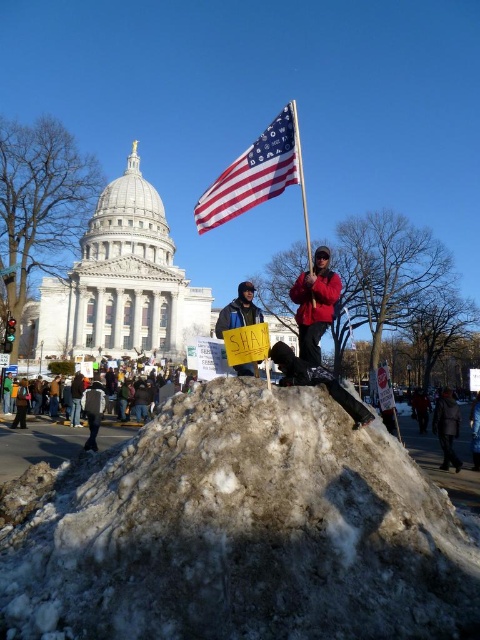
You are a photographer trying to capture the protest scene. You want to ensure the american flag at center and the red matte jacket at center are both visible in your shot. Based on their positions, which object should you focus on first to frame both effectively?

The american flag at center is located above the red matte jacket at center, so you should focus on the american flag at center first to ensure both are in frame.

You are a photographer standing at the camera position. You want to capture a closeup shot of the red matte jacket at center. Given that your camera has a minimum focusing distance of 2 meters, will you be able to take the photo without moving closer?

The distance between the red matte jacket at center and the camera is 71.96 meters, which is much greater than the camera minimum focusing distance of 2 meters. Therefore, you can take the closeup shot without moving closer.